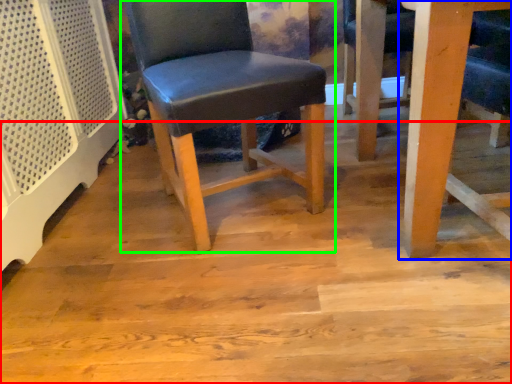
Question: Which object is positioned closest to plywood (highlighted by a red box)? Select from table (highlighted by a blue box) and chair (highlighted by a green box).

Choices:
 (A) table
 (B) chair

Answer: (B)